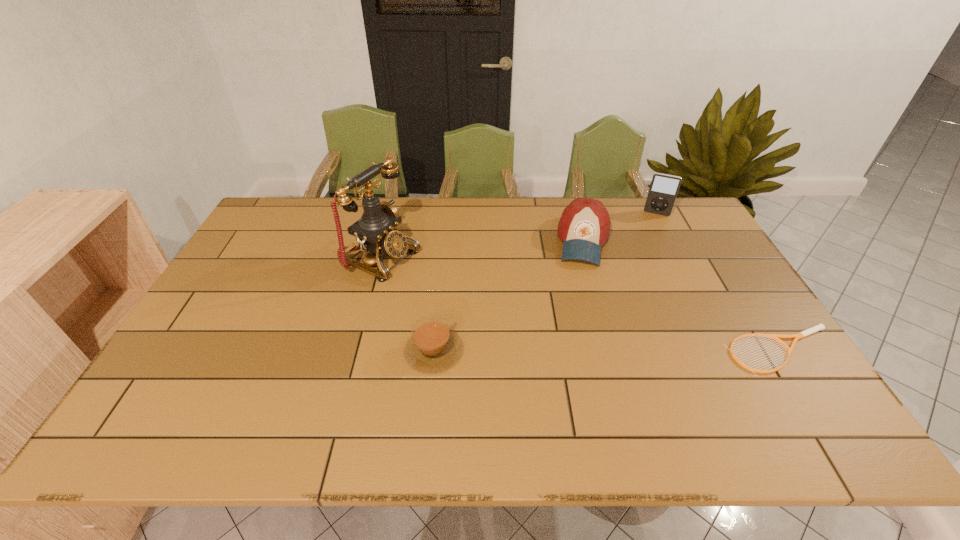
Where is `free spot on the desktop that is between the cappuccino and the tennis racket and is positioned on the front-facing side of the third object from left to right`? The height and width of the screenshot is (540, 960). free spot on the desktop that is between the cappuccino and the tennis racket and is positioned on the front-facing side of the third object from left to right is located at coordinates (574, 351).

This screenshot has height=540, width=960. What are the coordinates of `free space on the desktop that is between the second shortest object and the shortest object and is positioned on the front-facing side of the iPod` in the screenshot? It's located at (627, 351).

The image size is (960, 540). Identify the location of vacant space on the desktop that is between the fourth tallest object and the shortest object and is positioned on the front of the tallest object, featuring the rotary dial. (603, 351).